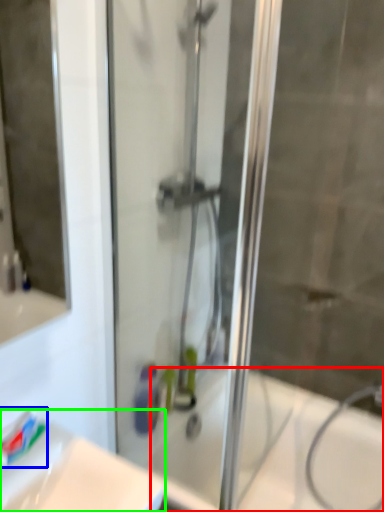
Question: Which object is the farthest from bath (highlighted by a red box)? Choose among these: toothpaste (highlighted by a blue box) or sink (highlighted by a green box).

Choices:
 (A) toothpaste
 (B) sink

Answer: (A)